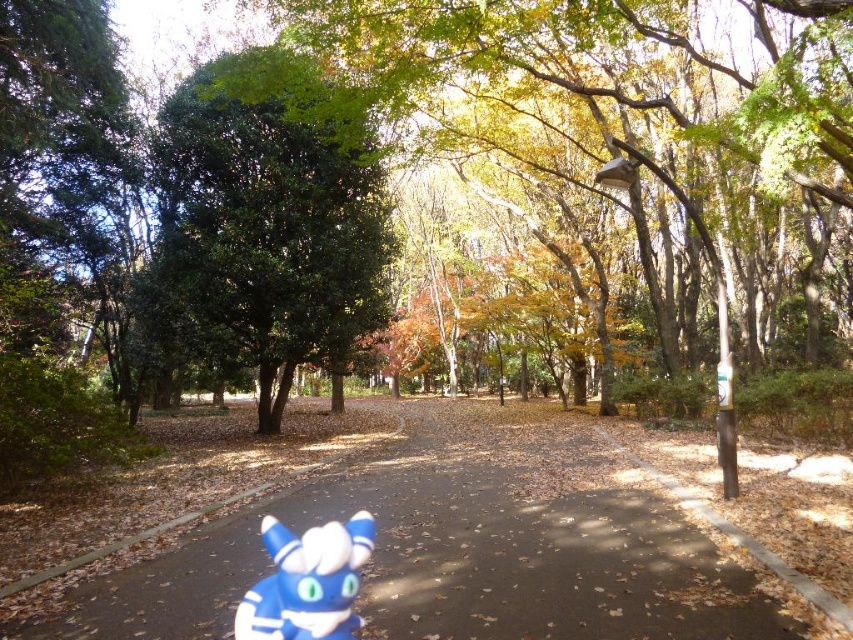
Which is more to the left, green leafy tree at center or blue rubber toy at center?

green leafy tree at center

This screenshot has width=853, height=640. Find the location of `green leafy tree at center`. green leafy tree at center is located at coordinates (268, 218).

Is point (241, 358) behind point (292, 636)?

That is True.

This screenshot has height=640, width=853. What are the coordinates of `green leafy tree at center` in the screenshot? It's located at (268, 218).

Does brown asphalt path at center have a lesser width compared to blue rubber toy at center?

Incorrect, brown asphalt path at center's width is not less than blue rubber toy at center's.

This screenshot has width=853, height=640. In order to click on brown asphalt path at center in this screenshot , I will do `click(502, 538)`.

Measure the distance from brown asphalt path at center to green leafy tree at center.

6.09 meters

Who is shorter, brown asphalt path at center or green leafy tree at center?

brown asphalt path at center is shorter.

You are a GUI agent. You are given a task and a screenshot of the screen. Output one action in this format:
    pyautogui.click(x=<x>, y=<y>)
    Task: Click on the brown asphalt path at center
    Image resolution: width=853 pixels, height=640 pixels.
    Given the screenshot: What is the action you would take?
    pyautogui.click(x=502, y=538)